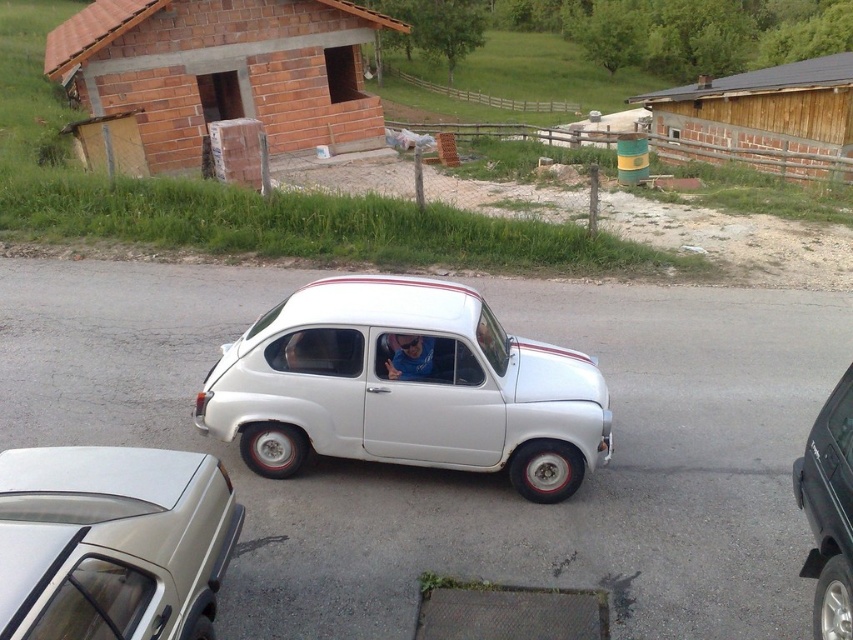
Question: Does white matte car at center have a greater width compared to silver metallic sedan at lower left?

Choices:
 (A) no
 (B) yes

Answer: (B)

Question: Is white matte car at center behind brown wooden hut at upper right?

Choices:
 (A) yes
 (B) no

Answer: (B)

Question: Which point is farther from the camera taking this photo?

Choices:
 (A) (341, 141)
 (B) (282, 371)
 (C) (51, 467)

Answer: (A)

Question: Among these points, which one is farthest from the camera?

Choices:
 (A) tap(526, 413)
 (B) tap(328, 42)
 (C) tap(840, 564)
 (D) tap(190, 508)

Answer: (B)

Question: Which object is positioned farthest from the white matte car at center?

Choices:
 (A) brick hut at upper left
 (B) black matte minivan at right
 (C) brown wooden hut at upper right
 (D) silver metallic sedan at lower left

Answer: (C)

Question: Does brown wooden hut at upper right appear under black matte minivan at right?

Choices:
 (A) yes
 (B) no

Answer: (B)